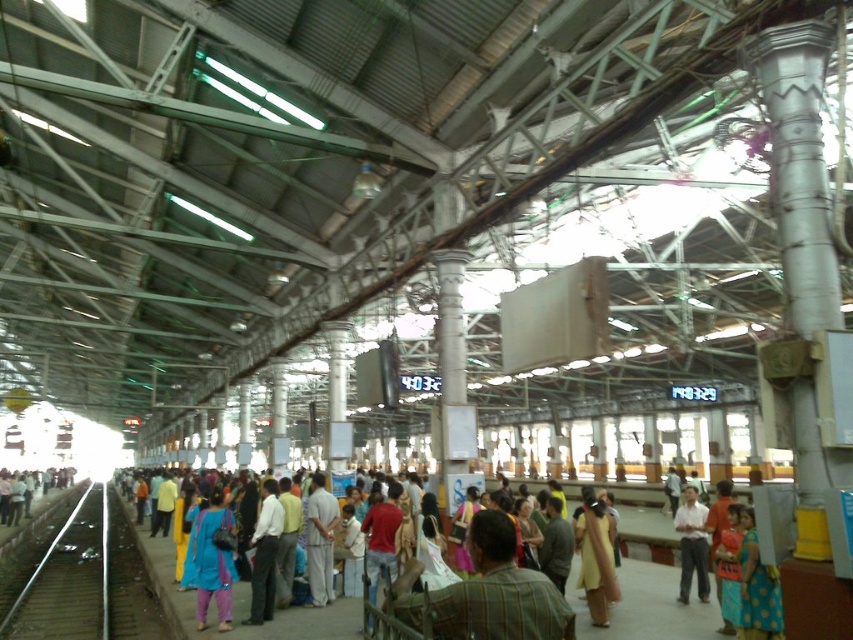
You are a photographer standing on the platform and want to capture both the light blue fabric dress at center and the light gray cotton shirt at center in a single photo. Which of the two clothing items will appear taller in the photo?

The light blue fabric dress at center will appear taller in the photo because it has a greater height compared to the light gray cotton shirt at center.

You are a photographer trying to capture a candid shot of the light blue fabric dress at center and the light gray cotton shirt at center. Which clothing item should you focus on first if you want to ensure they both fit in the frame without moving the camera? Explain your reasoning based on their sizes.

The light blue fabric dress at center is wider than the light gray cotton shirt at center. Therefore, focusing on the wider light blue fabric dress at center first will help ensure both fit in the frame without needing to adjust the camera position.

You are standing on the train station platform and see a point marked at coordinates (213, 561). According to the image, what object is this point located on?

The point at coordinates (213, 561) is located on the matte blue dress at center.